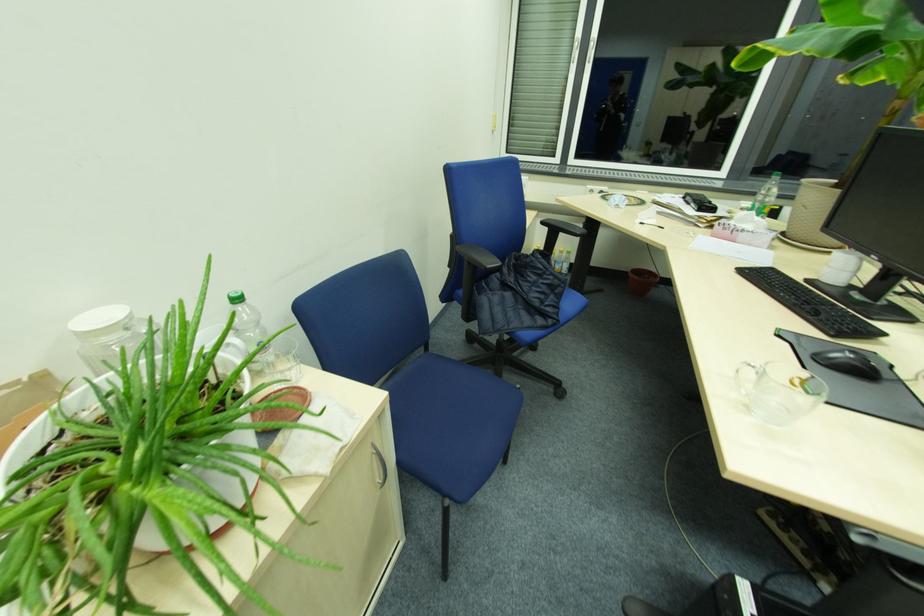
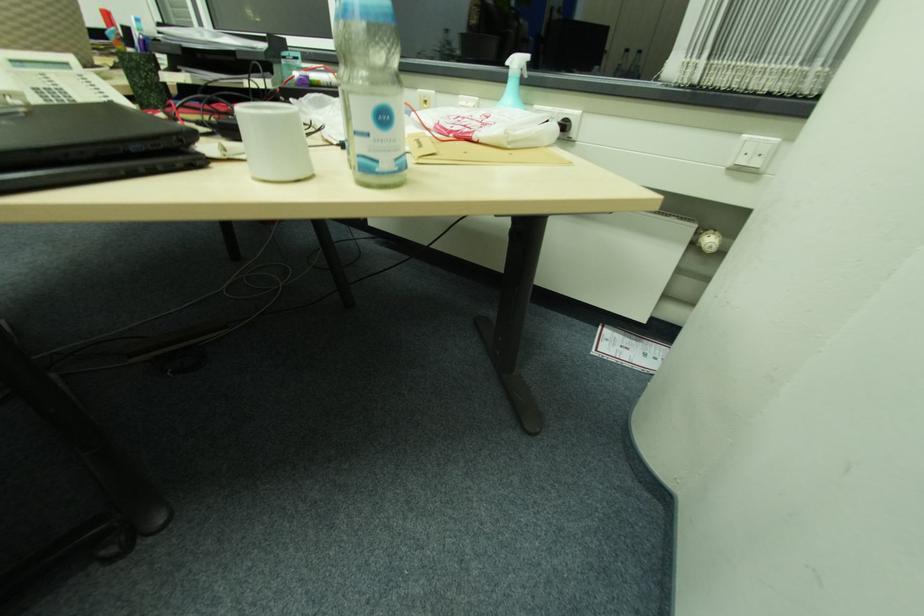
Question: In a continuous first-person perspective shot, in which direction is the camera moving?

Choices:
 (A) Left
 (B) Right
 (C) Forward
 (D) Backward

Answer: (B)